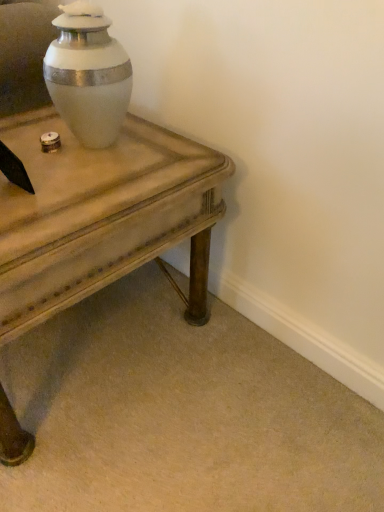
Question: From the image's perspective, is wooden side table at center located above or below white glossy urn at upper center?

Choices:
 (A) above
 (B) below

Answer: (B)

Question: From their relative heights in the image, would you say wooden side table at center is taller or shorter than white glossy urn at upper center?

Choices:
 (A) short
 (B) tall

Answer: (B)

Question: From a real-world perspective, is wooden side table at center above or below white glossy urn at upper center?

Choices:
 (A) below
 (B) above

Answer: (A)

Question: In terms of width, does white glossy urn at upper center look wider or thinner when compared to wooden side table at center?

Choices:
 (A) thin
 (B) wide

Answer: (A)

Question: From their relative heights in the image, would you say white glossy urn at upper center is taller or shorter than wooden side table at center?

Choices:
 (A) tall
 (B) short

Answer: (B)

Question: Is white glossy urn at upper center inside or outside of wooden side table at center?

Choices:
 (A) inside
 (B) outside

Answer: (B)

Question: From the image's perspective, relative to wooden side table at center, is white glossy urn at upper center above or below?

Choices:
 (A) below
 (B) above

Answer: (B)